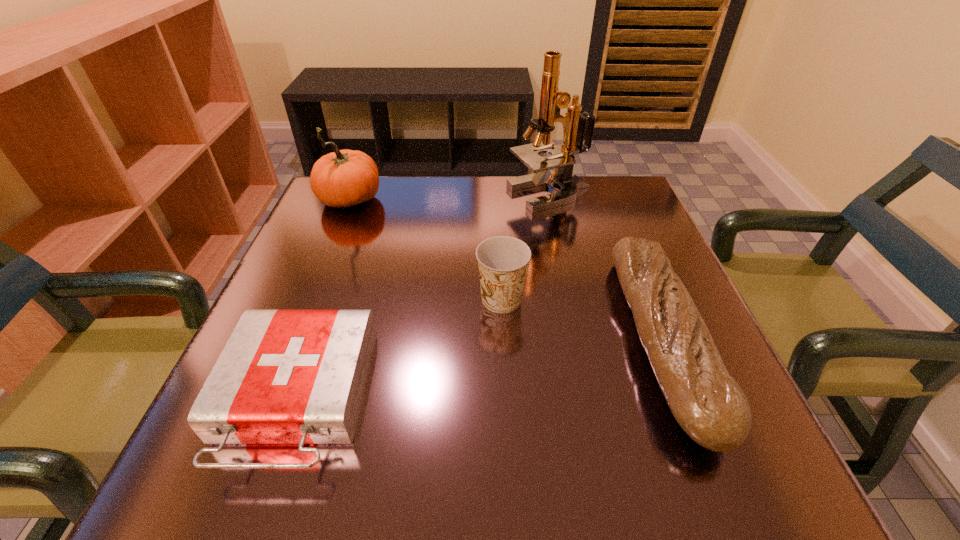
The width and height of the screenshot is (960, 540). I want to click on object located in the near left corner section of the desktop, so click(284, 376).

Locate an element on the screen. object at the far right corner is located at coordinates (562, 158).

The width and height of the screenshot is (960, 540). Identify the location of object that is at the near right corner. (709, 405).

The height and width of the screenshot is (540, 960). Identify the location of vacant area at the far edge of the desktop. (397, 218).

In the image, there is a desktop. Where is `vacant space at the left edge`? The image size is (960, 540). vacant space at the left edge is located at coordinates (363, 261).

I want to click on vacant position at the right edge of the desktop, so click(x=613, y=294).

Locate an element on the screen. The image size is (960, 540). free space at the far right corner of the desktop is located at coordinates (585, 221).

Locate an element on the screen. Image resolution: width=960 pixels, height=540 pixels. vacant space that's between the second shortest object and the microscope is located at coordinates (606, 266).

Locate an element on the screen. This screenshot has width=960, height=540. vacant point located between the Dixie cup and the baguet is located at coordinates (582, 319).

Find the location of a particular element. This screenshot has width=960, height=540. unoccupied area between the first-aid kit and the third tallest object is located at coordinates (399, 349).